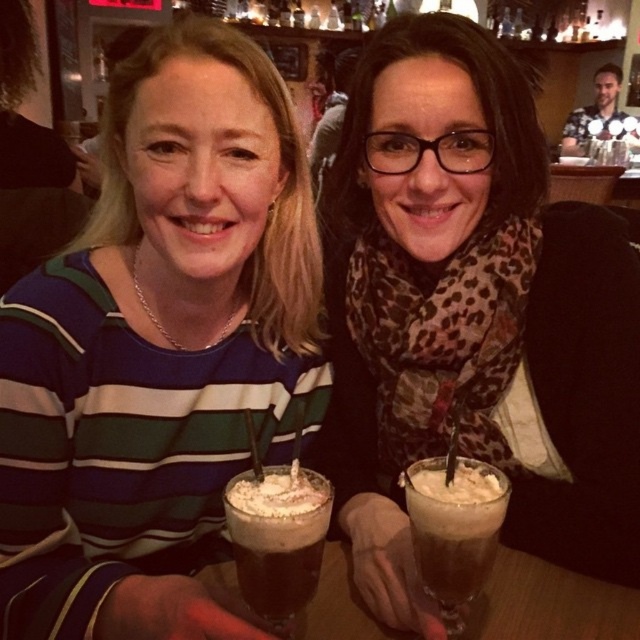
You are a GUI agent. You are given a task and a screenshot of the screen. Output one action in this format:
    pyautogui.click(x=<x>, y=<y>)
    Task: Click on the green striped sweater at center
    This screenshot has width=640, height=640.
    Given the screenshot: What is the action you would take?
    pyautogui.click(x=160, y=348)

Consider the image. Is green striped sweater at center taller than leopard print scarf at center?

Yes, green striped sweater at center is taller than leopard print scarf at center.

Where is `green striped sweater at center`? green striped sweater at center is located at coordinates (160, 348).

Is point (296, 630) more distant than point (296, 598)?

Yes, it is behind point (296, 598).

Does translucent glass cups at center have a greater height compared to dark brown foam at center?

Incorrect, translucent glass cups at center's height is not larger of dark brown foam at center's.

What do you see at coordinates (548, 604) in the screenshot? Image resolution: width=640 pixels, height=640 pixels. I see `translucent glass cups at center` at bounding box center [548, 604].

You are a GUI agent. You are given a task and a screenshot of the screen. Output one action in this format:
    pyautogui.click(x=<x>, y=<y>)
    Task: Click on the translucent glass cups at center
    
    Given the screenshot: What is the action you would take?
    pyautogui.click(x=548, y=604)

From the picture: Does leopard print scarf at center have a lesser height compared to translucent glass cups at center?

No.

Is point (364, 192) less distant than point (611, 595)?

No.

Identify the location of leopard print scarf at center. This screenshot has width=640, height=640. (472, 316).